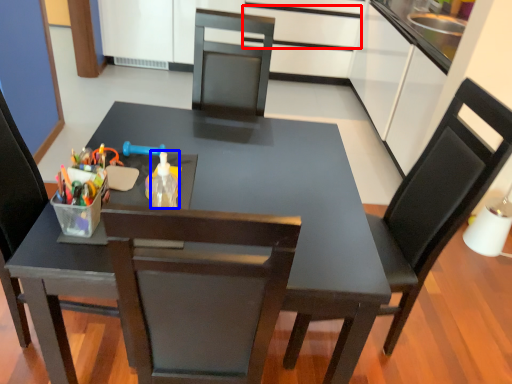
Question: Among these objects, which one is farthest to the camera, drawer (highlighted by a red box) or bottle (highlighted by a blue box)?

Choices:
 (A) drawer
 (B) bottle

Answer: (A)